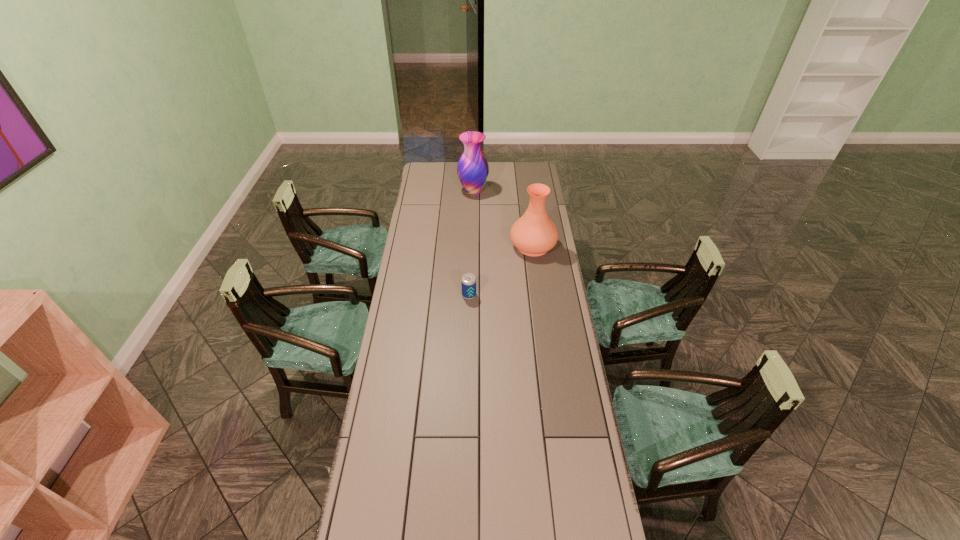
In the image, there is a desktop. At what (x,y) coordinates should I click in order to perform the action: click on vacant region at the far edge. Please return your answer as a coordinate pair (x, y). This screenshot has height=540, width=960. Looking at the image, I should click on (503, 167).

The image size is (960, 540). Identify the location of vacant space at the left edge of the desktop. (425, 264).

In the image, there is a desktop. Where is `vacant space at the right edge`? This screenshot has width=960, height=540. vacant space at the right edge is located at coordinates (543, 390).

In the image, there is a desktop. At what (x,y) coordinates should I click in order to perform the action: click on vacant space at the far left corner. Please return your answer as a coordinate pair (x, y). Looking at the image, I should click on (445, 164).

Where is `vacant space in between the shortest object and the rightmost object`? The width and height of the screenshot is (960, 540). vacant space in between the shortest object and the rightmost object is located at coordinates (501, 271).

I want to click on vacant area between the shortest object and the second farthest object, so click(x=501, y=271).

This screenshot has height=540, width=960. Identify the location of vacant space in between the left vase and the nearest object. (471, 244).

I want to click on vacant area between the second nearest object and the farthest object, so click(503, 219).

You are a GUI agent. You are given a task and a screenshot of the screen. Output one action in this format:
    pyautogui.click(x=<x>, y=<y>)
    Task: Click on the free space between the nearer vase and the nearest object
    This screenshot has height=540, width=960.
    Given the screenshot: What is the action you would take?
    pyautogui.click(x=501, y=271)

Image resolution: width=960 pixels, height=540 pixels. Identify the location of empty space that is in between the left vase and the rightmost object. (503, 219).